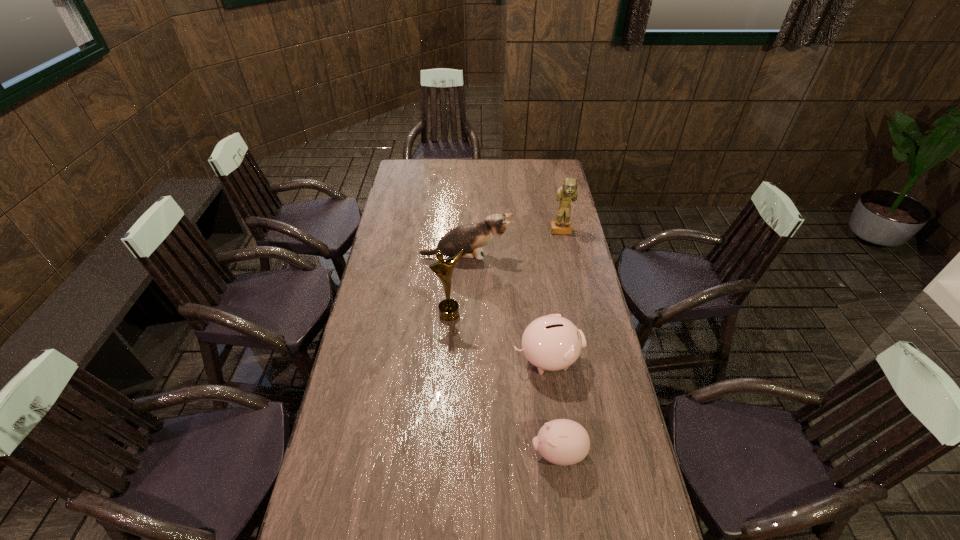
Image resolution: width=960 pixels, height=540 pixels. I want to click on free space at the far right corner of the desktop, so click(x=556, y=161).

Locate an element on the screen. This screenshot has height=540, width=960. vacant space that's between the farthest object and the third farthest object is located at coordinates (505, 273).

The width and height of the screenshot is (960, 540). Identify the location of vacant point located between the third shortest object and the farthest object. (514, 244).

Identify the location of free space between the second nearest object and the nearer piggy bank. (552, 406).

Identify the location of empty space between the second shortest object and the third farthest object. (498, 337).

This screenshot has width=960, height=540. I want to click on free space between the figurine and the third shortest object, so click(x=514, y=244).

Identify which object is the fourth closest to the award. Please provide its 2D coordinates. Your answer should be formatted as a tuple, i.e. [(x, y)], where the tuple contains the x and y coordinates of a point satisfying the conditions above.

[(568, 191)]

I want to click on object that is the second closest one to the second nearest object, so click(x=448, y=308).

Where is `piggy bank that is the second nearest to the cat`? The width and height of the screenshot is (960, 540). piggy bank that is the second nearest to the cat is located at coordinates (564, 442).

Where is `piggy bank object that ranks as the closest to the award`? The image size is (960, 540). piggy bank object that ranks as the closest to the award is located at coordinates (552, 343).